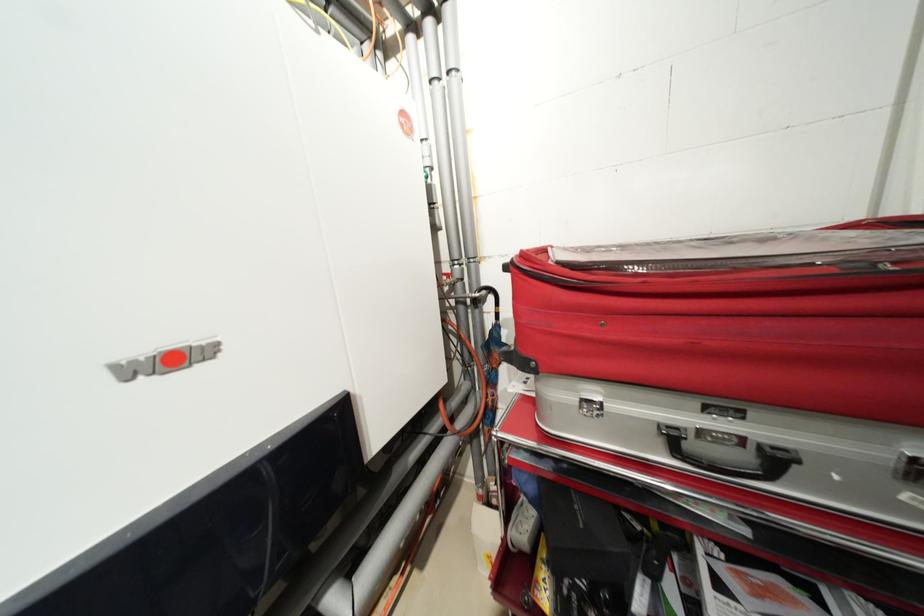
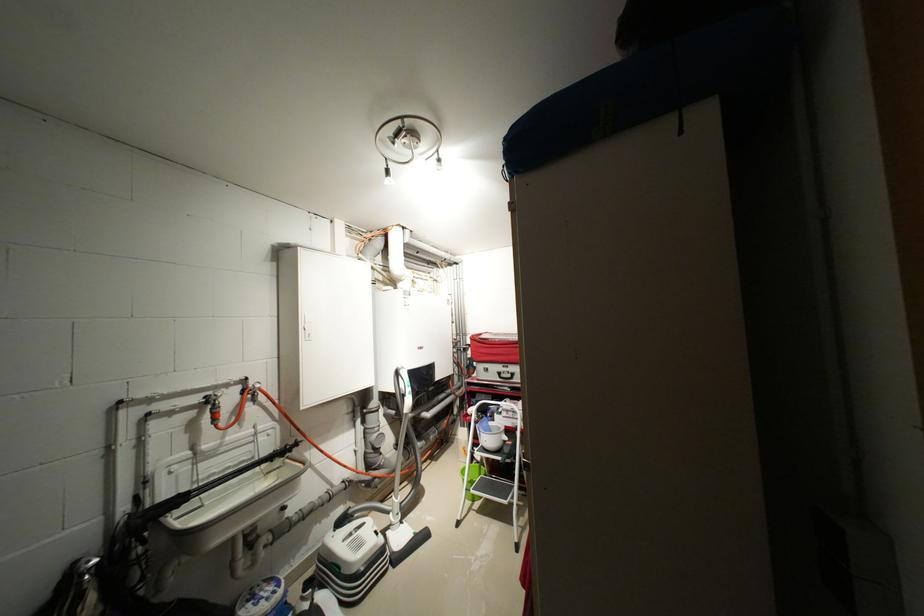
Locate, in the second image, the point that corresponds to pixel 465 276 in the first image.

(466, 341)